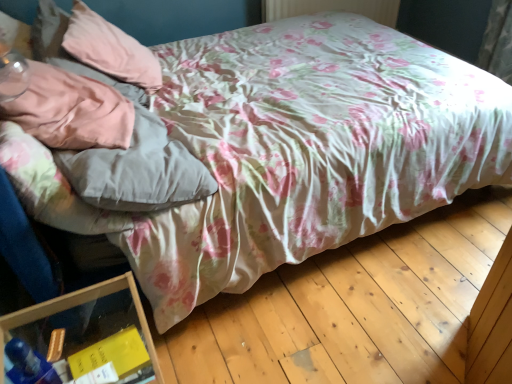
The image size is (512, 384). Identify the location of pink fabric pillow at upper left, marked as the second pillow in a front-to-back arrangement. (110, 49).

This screenshot has width=512, height=384. Describe the element at coordinates (71, 110) in the screenshot. I see `satin pink pillow at upper left, which is the second pillow in back-to-front order` at that location.

Looking at this image, measure the distance between point (101,137) and camera.

Point (101,137) and camera are 4.06 feet apart from each other.

In order to face transparent plastic container at lower left, should I rotate leftwards or rightwards?

Turn left approximately 21.010 degrees to face it.

The height and width of the screenshot is (384, 512). Find the location of `pink fabric pillow at upper left, the 1th pillow from the back`. pink fabric pillow at upper left, the 1th pillow from the back is located at coordinates (110, 49).

This screenshot has height=384, width=512. I want to click on the 1st pillow above the transparent plastic container at lower left (from the image's perspective), so click(x=71, y=110).

Considering the relative positions of transparent plastic container at lower left and satin pink pillow at upper left, which is the first pillow from front to back, in the image provided, is transparent plastic container at lower left to the left of satin pink pillow at upper left, which is the first pillow from front to back, from the viewer's perspective?

Incorrect, transparent plastic container at lower left is not on the left side of satin pink pillow at upper left, which is the first pillow from front to back.

From the image's perspective, is transparent plastic container at lower left located above or below satin pink pillow at upper left, which is the second pillow in back-to-front order?

Clearly, from the image's perspective, transparent plastic container at lower left is below satin pink pillow at upper left, which is the second pillow in back-to-front order.

Between pink fabric pillow at upper left, the 1th pillow from the back, and satin pink pillow at upper left, which is the second pillow in back-to-front order, which one appears on the right side from the viewer's perspective?

Positioned to the right is satin pink pillow at upper left, which is the second pillow in back-to-front order.

Looking at the image, does pink fabric pillow at upper left, the 1th pillow from the back, seem bigger or smaller compared to satin pink pillow at upper left, which is the first pillow from front to back?

pink fabric pillow at upper left, the 1th pillow from the back, is bigger than satin pink pillow at upper left, which is the first pillow from front to back.

Is pink fabric pillow at upper left, the 1th pillow from the back, not within satin pink pillow at upper left, which is the first pillow from front to back?

Absolutely, pink fabric pillow at upper left, the 1th pillow from the back, is external to satin pink pillow at upper left, which is the first pillow from front to back.

Is transparent plastic container at lower left located within pink fabric pillow at upper left, the 1th pillow from the back?

Definitely not — transparent plastic container at lower left is not inside pink fabric pillow at upper left, the 1th pillow from the back.

Considering the sizes of pink fabric pillow at upper left, the 1th pillow from the back, and transparent plastic container at lower left in the image, is pink fabric pillow at upper left, the 1th pillow from the back, wider or thinner than transparent plastic container at lower left?

In the image, pink fabric pillow at upper left, the 1th pillow from the back, appears to be wider than transparent plastic container at lower left.

Considering the relative sizes of pink fabric pillow at upper left, the 1th pillow from the back, and transparent plastic container at lower left in the image provided, is pink fabric pillow at upper left, the 1th pillow from the back, bigger than transparent plastic container at lower left?

No, pink fabric pillow at upper left, the 1th pillow from the back, is not bigger than transparent plastic container at lower left.

Which object is closer to the camera taking this photo, pink fabric pillow at upper left, the 1th pillow from the back, or transparent plastic container at lower left?

transparent plastic container at lower left.

Based on the photo, what's the angular difference between satin pink pillow at upper left, which is the second pillow in back-to-front order, and transparent plastic container at lower left's facing directions?

The angle between the facing direction of satin pink pillow at upper left, which is the second pillow in back-to-front order, and the facing direction of transparent plastic container at lower left is 16.4 degrees.

You are a GUI agent. You are given a task and a screenshot of the screen. Output one action in this format:
    pyautogui.click(x=<x>, y=<y>)
    Task: Click on the glass box lying in front of the satin pink pillow at upper left, which is the second pillow in back-to-front order
    Image resolution: width=512 pixels, height=384 pixels.
    Given the screenshot: What is the action you would take?
    pyautogui.click(x=77, y=305)

From a real-world perspective, is satin pink pillow at upper left, which is the second pillow in back-to-front order, physically above transparent plastic container at lower left?

Correct, in the physical world, satin pink pillow at upper left, which is the second pillow in back-to-front order, is higher than transparent plastic container at lower left.

Is transparent plastic container at lower left at the back of satin pink pillow at upper left, which is the first pillow from front to back?

No.

From a real-world perspective, between satin pink pillow at upper left, which is the second pillow in back-to-front order, and pink fabric pillow at upper left, marked as the second pillow in a front-to-back arrangement, who is vertically higher?

In real-world perspective, satin pink pillow at upper left, which is the second pillow in back-to-front order, is above.

Locate an element on the screen. pillow on the left of satin pink pillow at upper left, which is the first pillow from front to back is located at coordinates (110, 49).

Considering the relative sizes of satin pink pillow at upper left, which is the first pillow from front to back, and pink fabric pillow at upper left, the 1th pillow from the back, in the image provided, is satin pink pillow at upper left, which is the first pillow from front to back, smaller than pink fabric pillow at upper left, the 1th pillow from the back,?

Yes.

Considering the sizes of satin pink pillow at upper left, which is the second pillow in back-to-front order, and pink fabric pillow at upper left, marked as the second pillow in a front-to-back arrangement, in the image, is satin pink pillow at upper left, which is the second pillow in back-to-front order, wider or thinner than pink fabric pillow at upper left, marked as the second pillow in a front-to-back arrangement,?

satin pink pillow at upper left, which is the second pillow in back-to-front order, is thinner than pink fabric pillow at upper left, marked as the second pillow in a front-to-back arrangement.

Where is `the 2nd pillow to the left of the transparent plastic container at lower left, starting your count from the anchor`? the 2nd pillow to the left of the transparent plastic container at lower left, starting your count from the anchor is located at coordinates (110, 49).

Considering the sizes of objects transparent plastic container at lower left and pink fabric pillow at upper left, marked as the second pillow in a front-to-back arrangement, in the image provided, who is shorter, transparent plastic container at lower left or pink fabric pillow at upper left, marked as the second pillow in a front-to-back arrangement,?

pink fabric pillow at upper left, marked as the second pillow in a front-to-back arrangement, is shorter.

From the image's perspective, is transparent plastic container at lower left below pink fabric pillow at upper left, marked as the second pillow in a front-to-back arrangement?

Yes, from the image's perspective, transparent plastic container at lower left is below pink fabric pillow at upper left, marked as the second pillow in a front-to-back arrangement.

Is transparent plastic container at lower left further to camera compared to pink fabric pillow at upper left, the 1th pillow from the back?

No, transparent plastic container at lower left is closer to the viewer.

Find the location of a particular element. glass box to the right of satin pink pillow at upper left, which is the first pillow from front to back is located at coordinates (77, 305).

The width and height of the screenshot is (512, 384). I want to click on pillow that appears above the satin pink pillow at upper left, which is the second pillow in back-to-front order (from the image's perspective), so click(110, 49).

Estimate the real-world distances between objects in this image. Which object is closer to transparent plastic container at lower left, pink fabric pillow at upper left, marked as the second pillow in a front-to-back arrangement, or satin pink pillow at upper left, which is the second pillow in back-to-front order?

Among the two, satin pink pillow at upper left, which is the second pillow in back-to-front order, is located nearer to transparent plastic container at lower left.

Looking at the image, which one is located further to pink fabric pillow at upper left, marked as the second pillow in a front-to-back arrangement, satin pink pillow at upper left, which is the first pillow from front to back, or transparent plastic container at lower left?

Among the two, transparent plastic container at lower left is located further to pink fabric pillow at upper left, marked as the second pillow in a front-to-back arrangement.

Based on the photo, from the image, which object appears to be nearer to satin pink pillow at upper left, which is the second pillow in back-to-front order, transparent plastic container at lower left or pink fabric pillow at upper left, marked as the second pillow in a front-to-back arrangement?

pink fabric pillow at upper left, marked as the second pillow in a front-to-back arrangement, is closer to satin pink pillow at upper left, which is the second pillow in back-to-front order.

From the image, which object appears to be nearer to transparent plastic container at lower left, satin pink pillow at upper left, which is the second pillow in back-to-front order, or pink fabric pillow at upper left, marked as the second pillow in a front-to-back arrangement?

Based on the image, satin pink pillow at upper left, which is the second pillow in back-to-front order, appears to be nearer to transparent plastic container at lower left.

Considering their positions, is pink fabric pillow at upper left, marked as the second pillow in a front-to-back arrangement, positioned further to satin pink pillow at upper left, which is the first pillow from front to back, than transparent plastic container at lower left?

Based on the image, transparent plastic container at lower left appears to be further to satin pink pillow at upper left, which is the first pillow from front to back.

When comparing their distances from pink fabric pillow at upper left, the 1th pillow from the back, does transparent plastic container at lower left or satin pink pillow at upper left, which is the first pillow from front to back, seem closer?

The object closer to pink fabric pillow at upper left, the 1th pillow from the back, is satin pink pillow at upper left, which is the first pillow from front to back.

Find the location of a particular element. pillow between pink fabric pillow at upper left, marked as the second pillow in a front-to-back arrangement, and transparent plastic container at lower left, in the vertical direction is located at coordinates (71, 110).